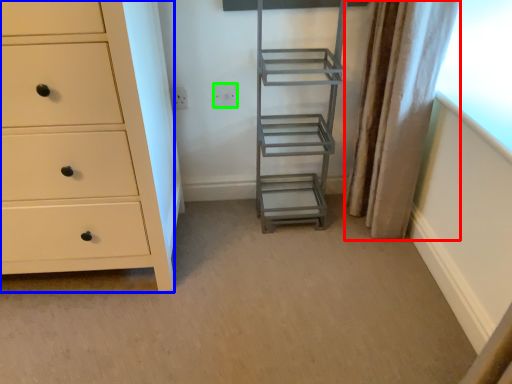
Question: Based on their relative distances, which object is farther from curtain (highlighted by a red box)? Choose from chest of drawers (highlighted by a blue box) and electric outlet (highlighted by a green box).

Choices:
 (A) chest of drawers
 (B) electric outlet

Answer: (A)